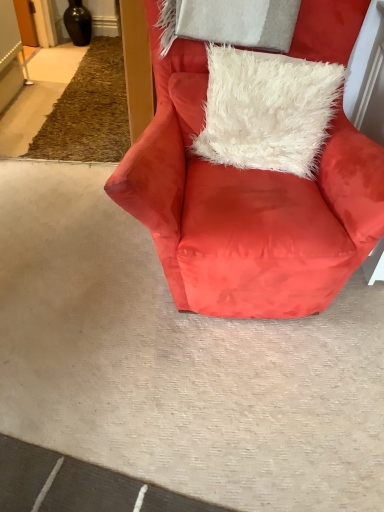
Question: Is white fluffy pillow at center situated inside satin red armchair at center or outside?

Choices:
 (A) inside
 (B) outside

Answer: (A)

Question: From a real-world perspective, relative to satin red armchair at center, is white fluffy pillow at center vertically above or below?

Choices:
 (A) below
 (B) above

Answer: (B)

Question: In the image, is white fluffy pillow at center positioned in front of or behind satin red armchair at center?

Choices:
 (A) front
 (B) behind

Answer: (B)

Question: Would you say satin red armchair at center is inside or outside white fluffy pillow at center?

Choices:
 (A) outside
 (B) inside

Answer: (A)

Question: Considering the relative positions of satin red armchair at center and white fluffy pillow at center in the image provided, is satin red armchair at center to the left or to the right of white fluffy pillow at center?

Choices:
 (A) right
 (B) left

Answer: (B)

Question: Is satin red armchair at center wider or thinner than white fluffy pillow at center?

Choices:
 (A) wide
 (B) thin

Answer: (A)

Question: Looking at the image, does satin red armchair at center seem bigger or smaller compared to white fluffy pillow at center?

Choices:
 (A) big
 (B) small

Answer: (A)